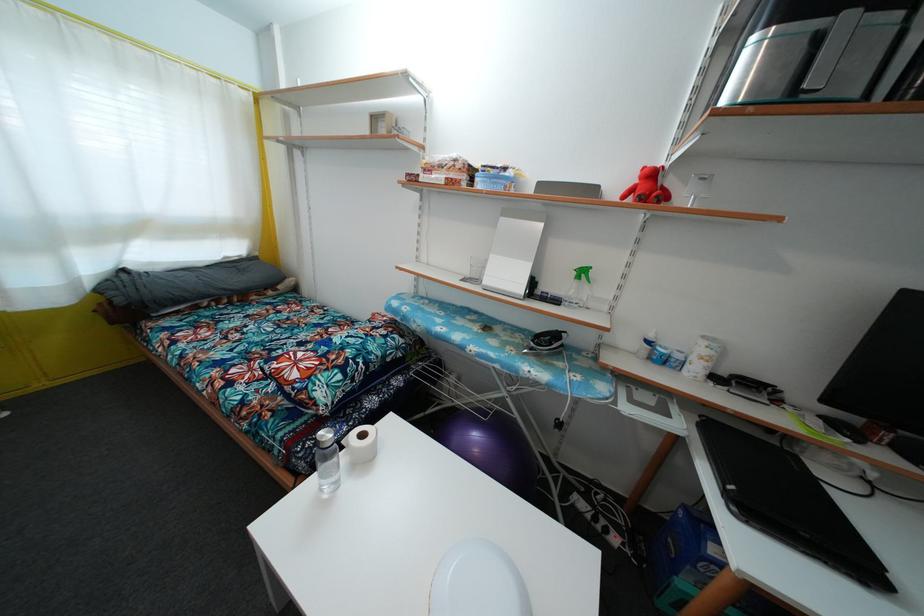
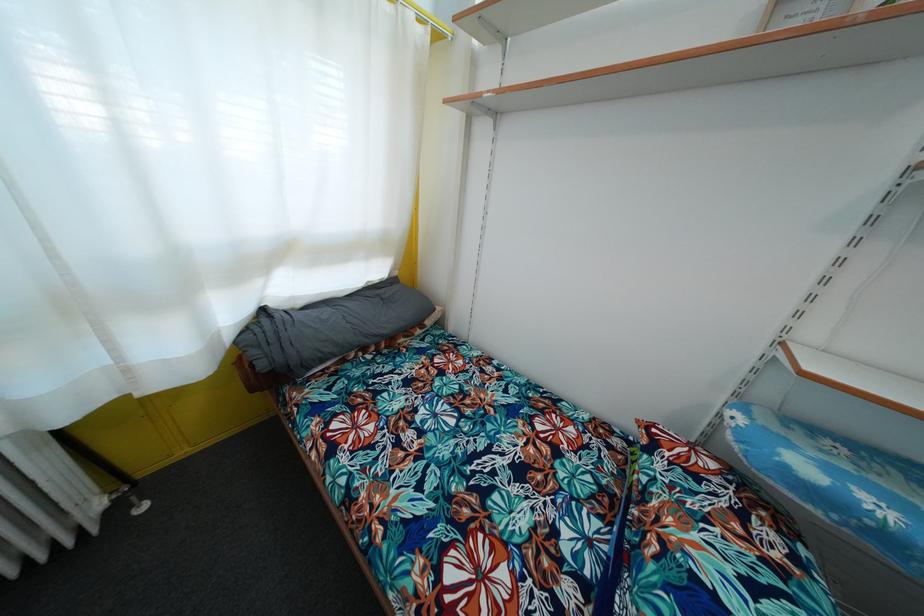
The images are taken continuously from a first-person perspective. In which direction are you moving?

The movement direction of the cameraman is left, forward.